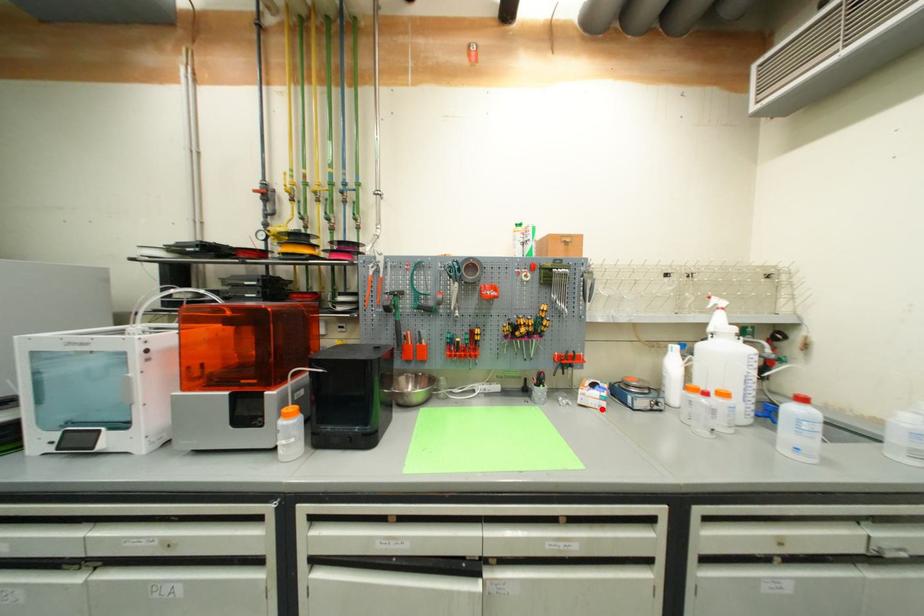
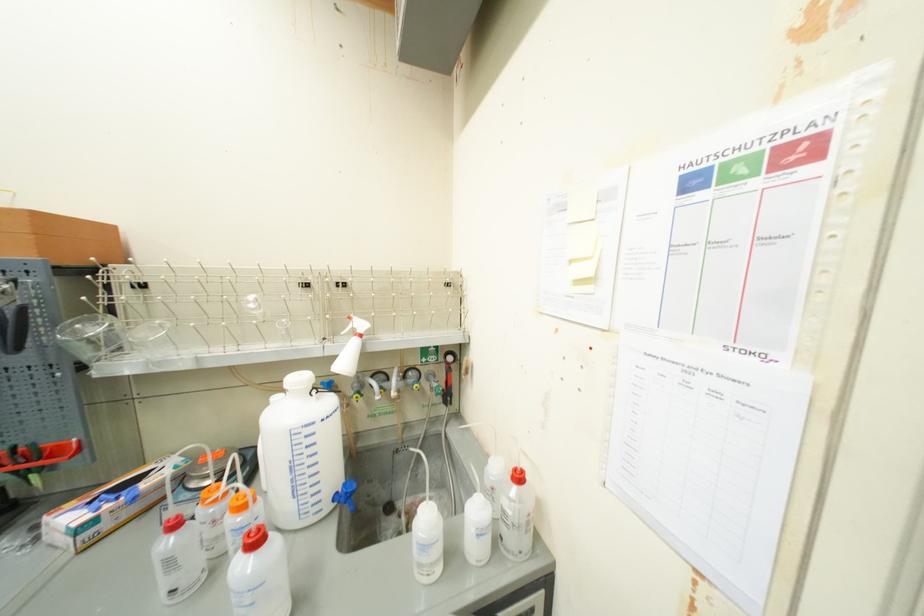
Find the pixel in the second image that matches the highlighted location in the first image.

(69, 551)